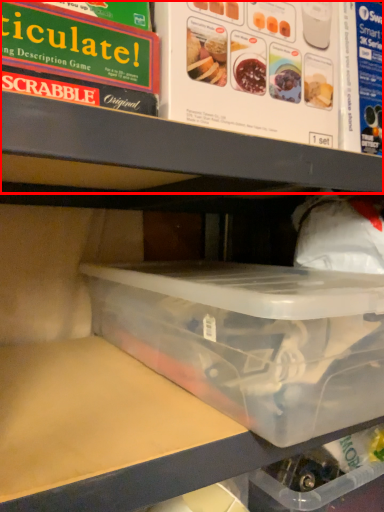
Question: From the image's perspective, what is the correct spatial positioning of shelf (annotated by the red box) in reference to box?

Choices:
 (A) above
 (B) below

Answer: (A)